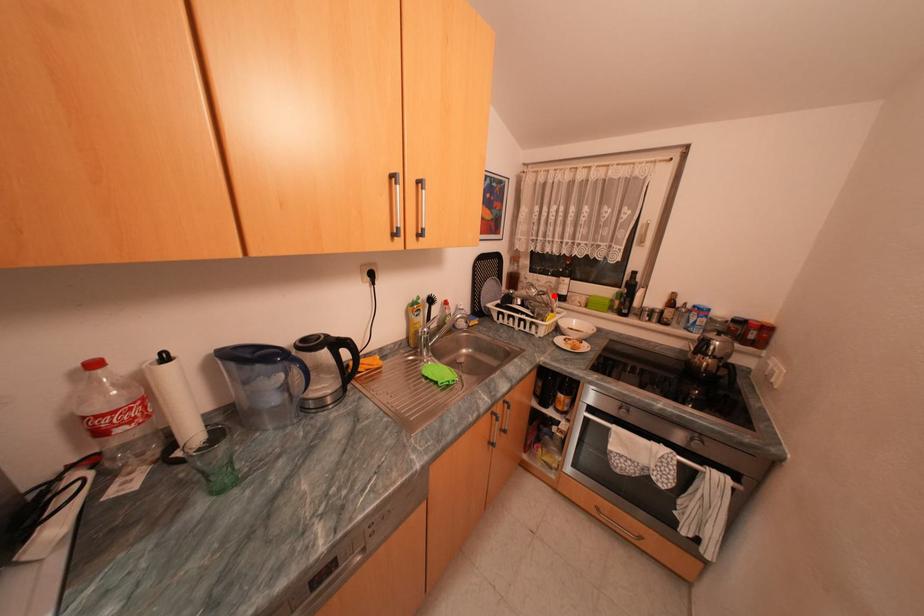
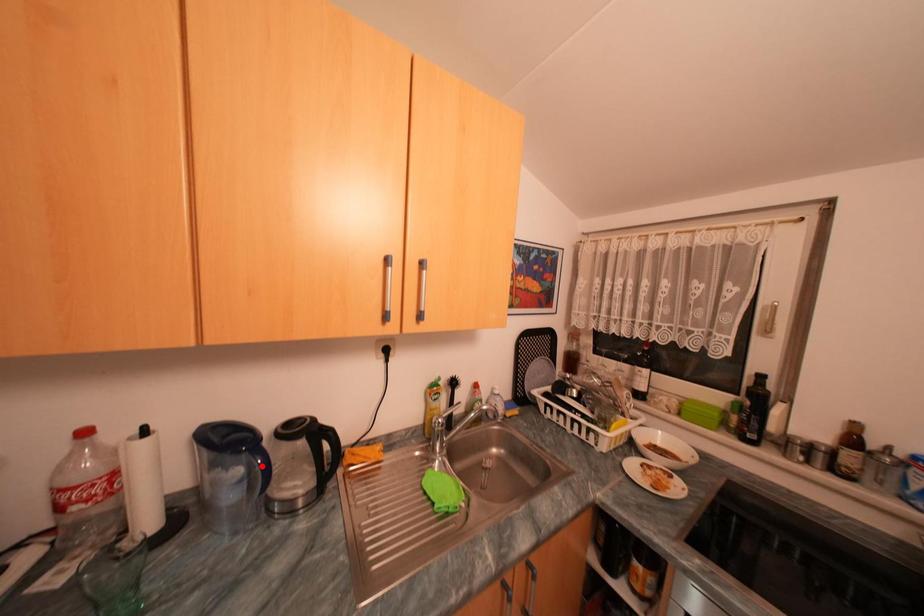
I am providing you with two images of the same scene from different viewpoints. A red point is marked on the first image and another point is marked on the second image. Is the marked point in image1 the same physical position as the marked point in image2?

No